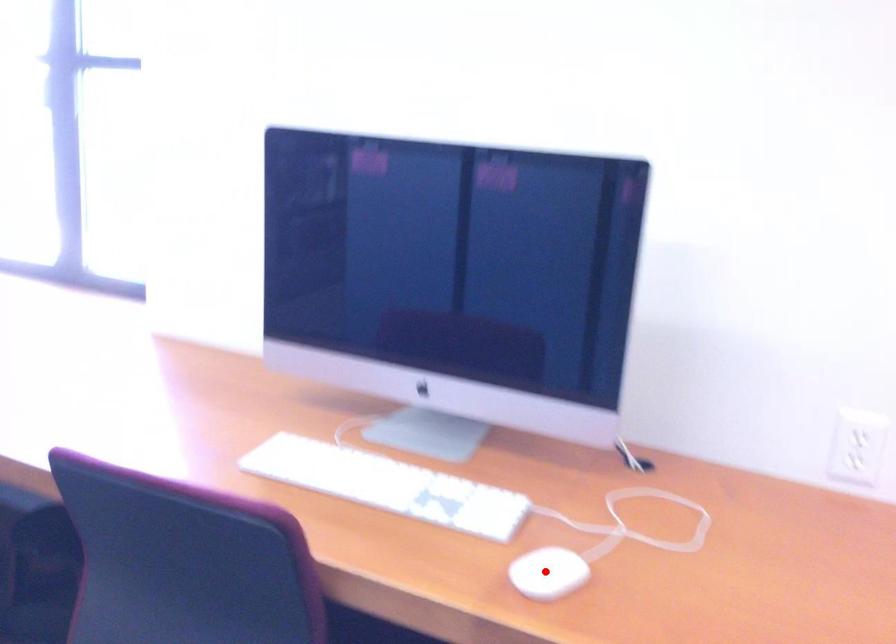
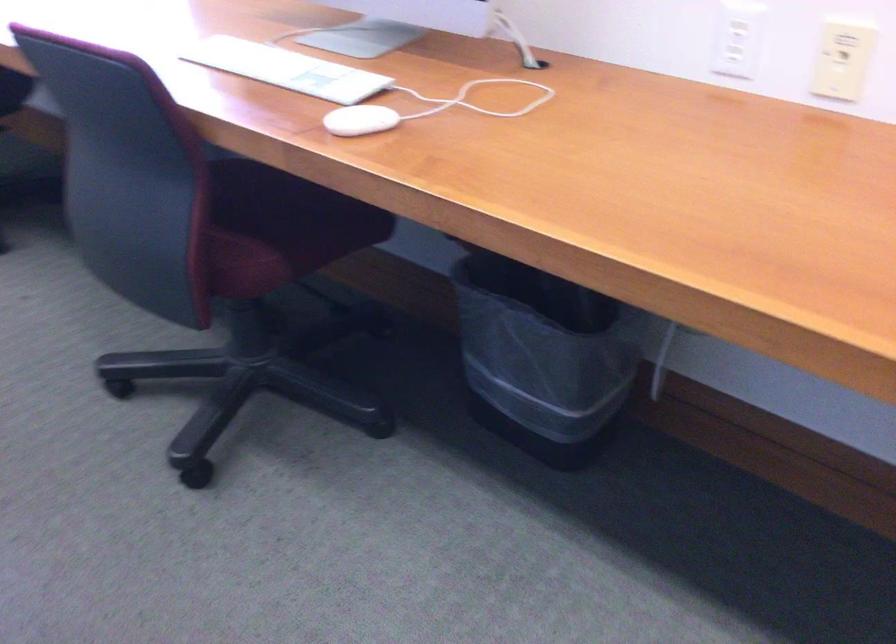
Locate, in the second image, the point that corresponds to the highlighted location in the first image.

(359, 120)